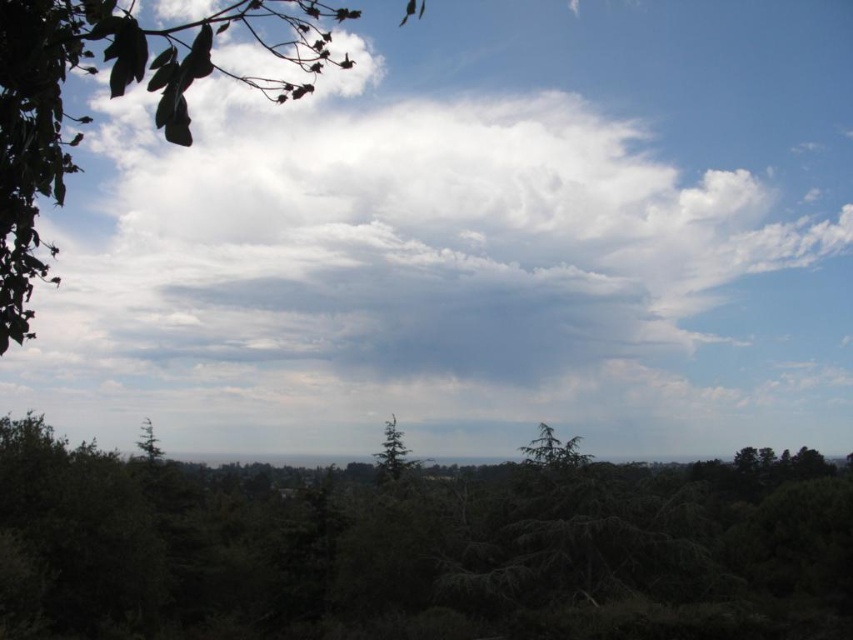
Is point (194, 620) closer to viewer compared to point (231, 72)?

Yes, point (194, 620) is in front of point (231, 72).

From the picture: Who is taller, dark green textured trees at lower center or green leafy branch at upper left?

With more height is green leafy branch at upper left.

I want to click on dark green textured trees at lower center, so click(x=419, y=548).

I want to click on dark green textured trees at lower center, so click(x=419, y=548).

Does green leafy branch at upper left have a greater height compared to green matte tree at center?

Yes.

Is green leafy branch at upper left shorter than green matte tree at center?

Incorrect, green leafy branch at upper left's height does not fall short of green matte tree at center's.

You are a GUI agent. You are given a task and a screenshot of the screen. Output one action in this format:
    pyautogui.click(x=<x>, y=<y>)
    Task: Click on the green leafy branch at upper left
    The image size is (853, 640).
    Given the screenshot: What is the action you would take?
    pyautogui.click(x=111, y=97)

Does green textured tree at center have a smaller size compared to green matte tree at center?

Yes, green textured tree at center is smaller than green matte tree at center.

Is point (546, 448) positioned in front of point (396, 442)?

That is True.

At what (x,y) coordinates should I click in order to perform the action: click on green textured tree at center. Please return your answer as a coordinate pair (x, y). Looking at the image, I should click on (553, 449).